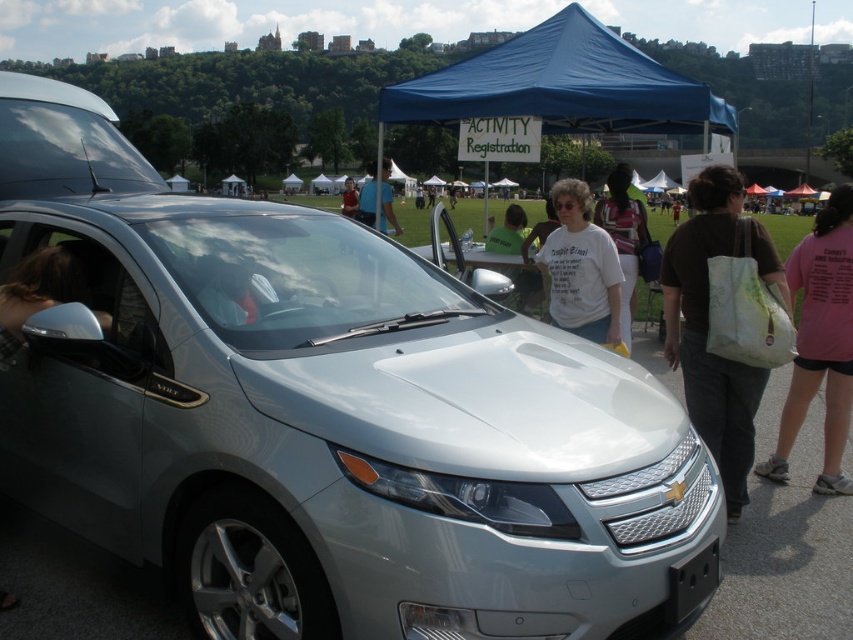
In the scene shown: Is shiny chrome side mirror at left further to camera compared to white cotton shirt at center?

No, shiny chrome side mirror at left is closer to the viewer.

Which is more to the left, shiny chrome side mirror at left or white cotton shirt at center?

Positioned to the left is shiny chrome side mirror at left.

Image resolution: width=853 pixels, height=640 pixels. What are the coordinates of `shiny chrome side mirror at left` in the screenshot? It's located at (38, 292).

Which of these two, matte white tote bag at right or matte black shirt at center, stands shorter?

With less height is matte white tote bag at right.

Is matte white tote bag at right shorter than matte black shirt at center?

Yes.

Locate an element on the screen. matte white tote bag at right is located at coordinates (705, 330).

Identify the location of matte white tote bag at right. (705, 330).

Measure the distance between matte white tote bag at right and shiny chrome side mirror at left.

A distance of 3.41 meters exists between matte white tote bag at right and shiny chrome side mirror at left.

Who is higher up, matte white tote bag at right or shiny chrome side mirror at left?

shiny chrome side mirror at left

This screenshot has width=853, height=640. Identify the location of matte white tote bag at right. (705, 330).